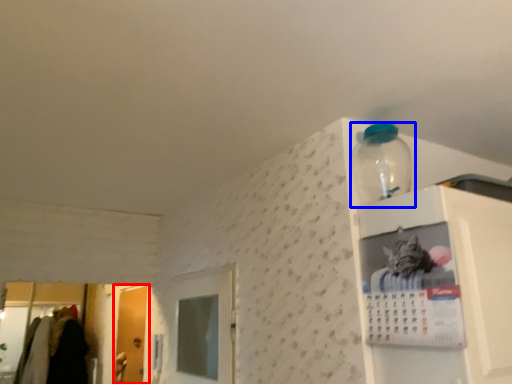
Question: Which of the following is the farthest to the observer, door (highlighted by a red box) or bottle (highlighted by a blue box)?

Choices:
 (A) door
 (B) bottle

Answer: (A)